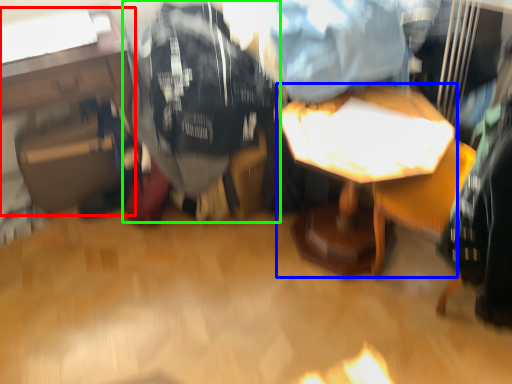
Question: Estimate the real-world distances between objects in this image. Which object is farther from table (highlighted by a red box), table (highlighted by a blue box) or clothing (highlighted by a green box)?

Choices:
 (A) table
 (B) clothing

Answer: (A)